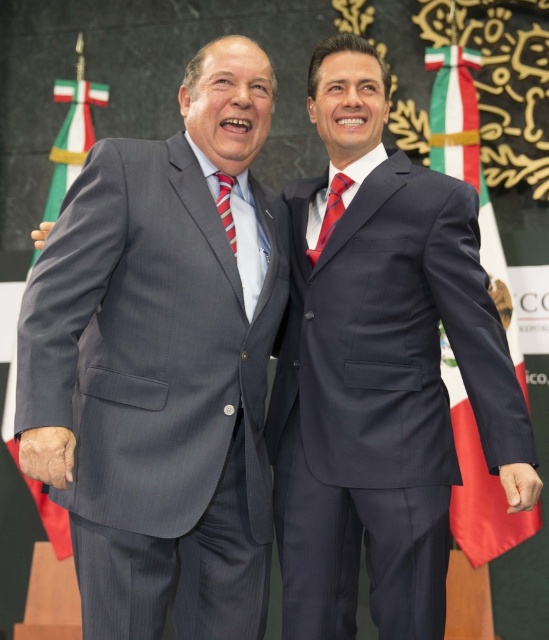
Question: Can you confirm if navy blue suit at center is bigger than red fabric flag at right?

Choices:
 (A) no
 (B) yes

Answer: (B)

Question: Is navy blue suit at center positioned in front of striped fabric tie at center?

Choices:
 (A) yes
 (B) no

Answer: (A)

Question: Can you confirm if green fabric flag at left is smaller than striped fabric tie at center?

Choices:
 (A) no
 (B) yes

Answer: (A)

Question: Which of the following is the closest to the observer?

Choices:
 (A) (334, 189)
 (B) (467, 115)
 (C) (44, 516)
 (D) (40, 300)

Answer: (D)

Question: Which point is closer to the camera?

Choices:
 (A) (154, 490)
 (B) (453, 131)
 (C) (372, 332)

Answer: (A)

Question: Which object is farther from the camera taking this photo?

Choices:
 (A) silky red tie at center
 (B) red fabric flag at right
 (C) gray pinstripe suit at left
 (D) green fabric flag at left

Answer: (B)